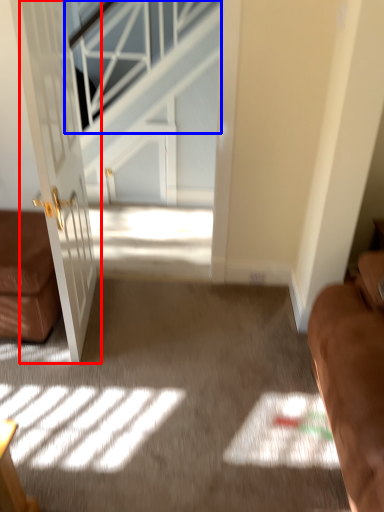
Question: Among these objects, which one is nearest to the camera, door (highlighted by a red box) or window (highlighted by a blue box)?

Choices:
 (A) door
 (B) window

Answer: (A)